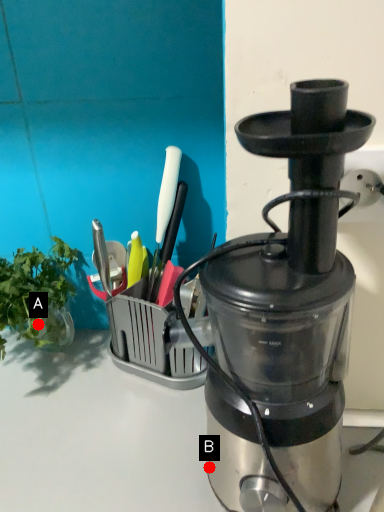
Question: Two points are circled on the image, labeled by A and B beside each circle. Which of the following is the farthest from the observer?

Choices:
 (A) A is further
 (B) B is further

Answer: (A)